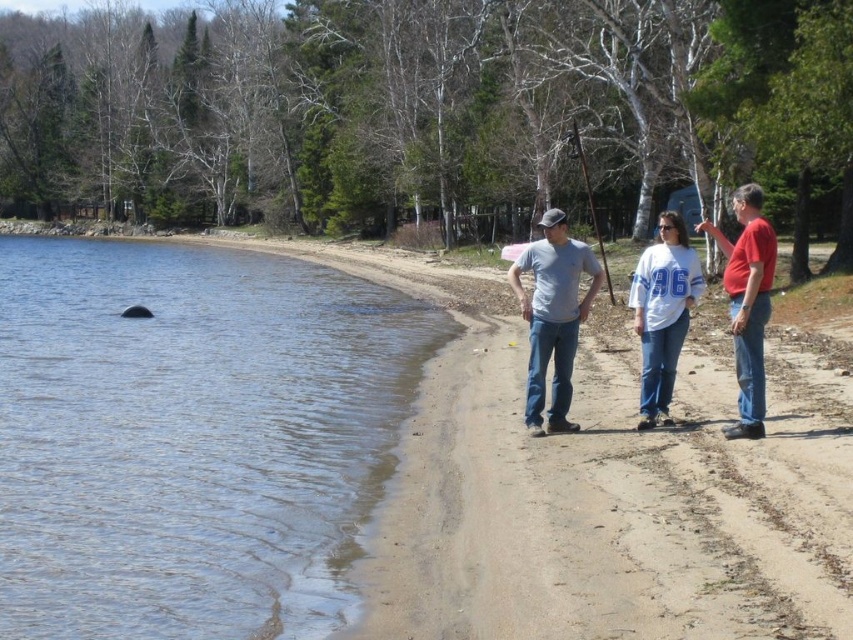
You are standing at the point marked by the coordinates (747, 301) on the image. What object are you currently standing on?

You are standing on the white cotton shirt at center.

You are standing at the shoreline and want to walk towards the two points marked in the image. Which point would you reach first, point (x=668, y=248) or point (x=763, y=257)?

You would reach point (x=668, y=248) first because it is closer to you than point (x=763, y=257), which is further away.